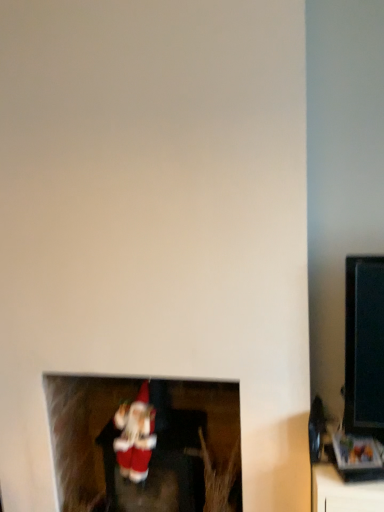
Question: Is velvet santa at lower center at the right side of red plush santa at lower center?

Choices:
 (A) yes
 (B) no

Answer: (A)

Question: Is velvet santa at lower center smaller than red plush santa at lower center?

Choices:
 (A) yes
 (B) no

Answer: (B)

Question: Considering the relative sizes of velvet santa at lower center and red plush santa at lower center in the image provided, is velvet santa at lower center shorter than red plush santa at lower center?

Choices:
 (A) yes
 (B) no

Answer: (B)

Question: From a real-world perspective, does velvet santa at lower center sit lower than red plush santa at lower center?

Choices:
 (A) yes
 (B) no

Answer: (A)

Question: From a real-world perspective, is velvet santa at lower center located higher than red plush santa at lower center?

Choices:
 (A) yes
 (B) no

Answer: (B)

Question: Can you confirm if velvet santa at lower center is wider than red plush santa at lower center?

Choices:
 (A) yes
 (B) no

Answer: (A)

Question: Is red plush santa at lower center shorter than velvet santa at lower center?

Choices:
 (A) yes
 (B) no

Answer: (A)

Question: From a real-world perspective, is red plush santa at lower center over velvet santa at lower center?

Choices:
 (A) yes
 (B) no

Answer: (A)

Question: Is the depth of red plush santa at lower center greater than that of velvet santa at lower center?

Choices:
 (A) yes
 (B) no

Answer: (B)

Question: From the image's perspective, does red plush santa at lower center appear higher than velvet santa at lower center?

Choices:
 (A) yes
 (B) no

Answer: (A)

Question: Is velvet santa at lower center located within red plush santa at lower center?

Choices:
 (A) no
 (B) yes

Answer: (A)

Question: Does red plush santa at lower center have a greater height compared to velvet santa at lower center?

Choices:
 (A) yes
 (B) no

Answer: (B)

Question: From a real-world perspective, is red plush santa at lower center positioned above or below velvet santa at lower center?

Choices:
 (A) above
 (B) below

Answer: (A)